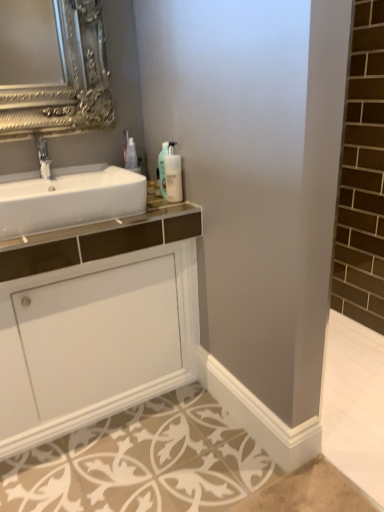
Image resolution: width=384 pixels, height=512 pixels. Find the location of `vacant space in front of translucent plastic soap dispenser at upper center, which is the 1th soap dispenser from right to left`. vacant space in front of translucent plastic soap dispenser at upper center, which is the 1th soap dispenser from right to left is located at coordinates (160, 212).